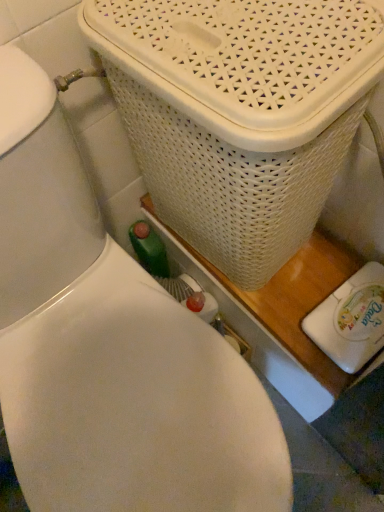
Question: Is white plastic toilet brush at lower right situated inside white woven basket at upper right or outside?

Choices:
 (A) inside
 (B) outside

Answer: (B)

Question: Considering the positions of white plastic toilet brush at lower right and white woven basket at upper right in the image, is white plastic toilet brush at lower right wider or thinner than white woven basket at upper right?

Choices:
 (A) thin
 (B) wide

Answer: (A)

Question: Considering the positions of point (334, 362) and point (324, 18), is point (334, 362) closer or farther from the camera than point (324, 18)?

Choices:
 (A) closer
 (B) farther

Answer: (B)

Question: From the image's perspective, is white woven basket at upper right located above or below white plastic toilet brush at lower right?

Choices:
 (A) above
 (B) below

Answer: (A)

Question: From a real-world perspective, is white woven basket at upper right positioned above or below white plastic toilet brush at lower right?

Choices:
 (A) above
 (B) below

Answer: (A)

Question: Considering the positions of white woven basket at upper right and white plastic toilet brush at lower right in the image, is white woven basket at upper right wider or thinner than white plastic toilet brush at lower right?

Choices:
 (A) thin
 (B) wide

Answer: (B)

Question: Considering the relative positions of white woven basket at upper right and white plastic toilet brush at lower right in the image provided, is white woven basket at upper right to the left or to the right of white plastic toilet brush at lower right?

Choices:
 (A) right
 (B) left

Answer: (B)